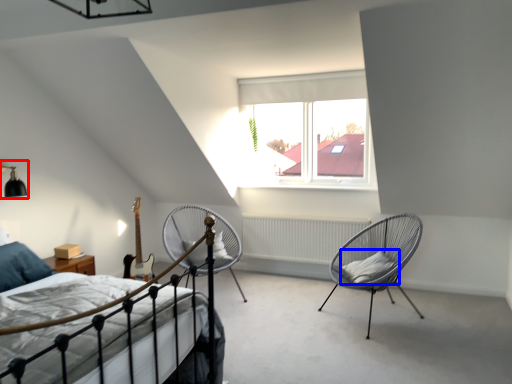
Question: Which point is further to the camera, light fixture (highlighted by a red box) or pillow (highlighted by a blue box)?

Choices:
 (A) light fixture
 (B) pillow

Answer: (B)